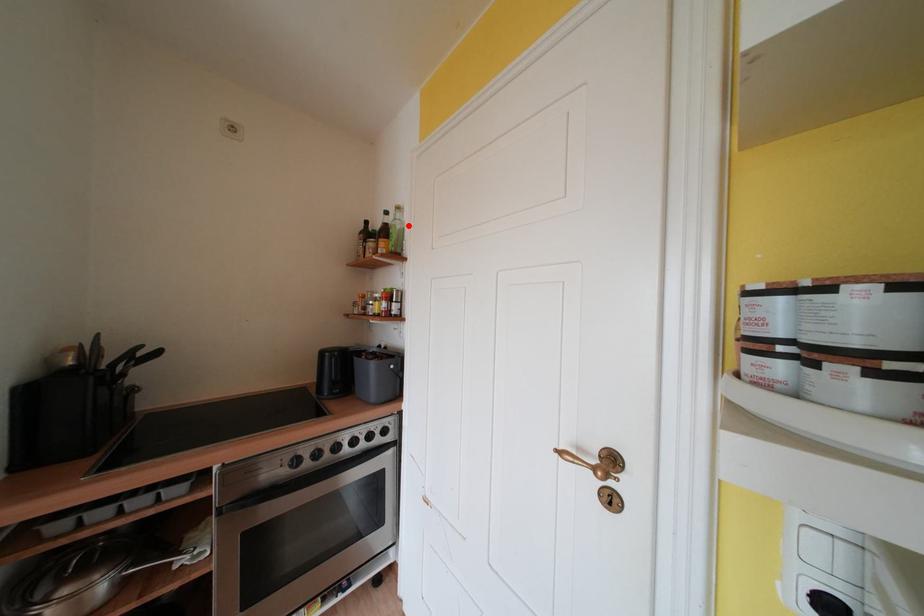
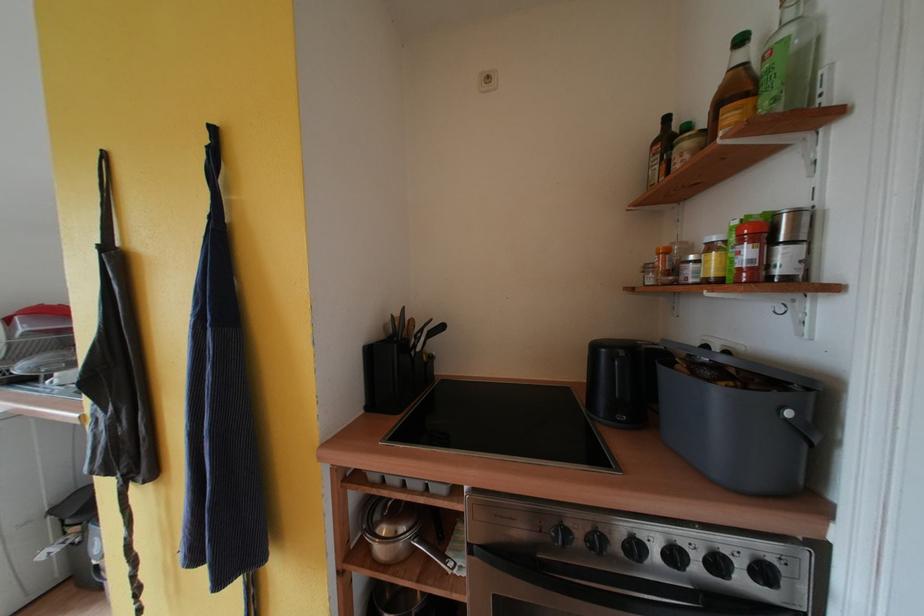
Find the pixel in the second image that matches the highlighted location in the first image.

(817, 28)